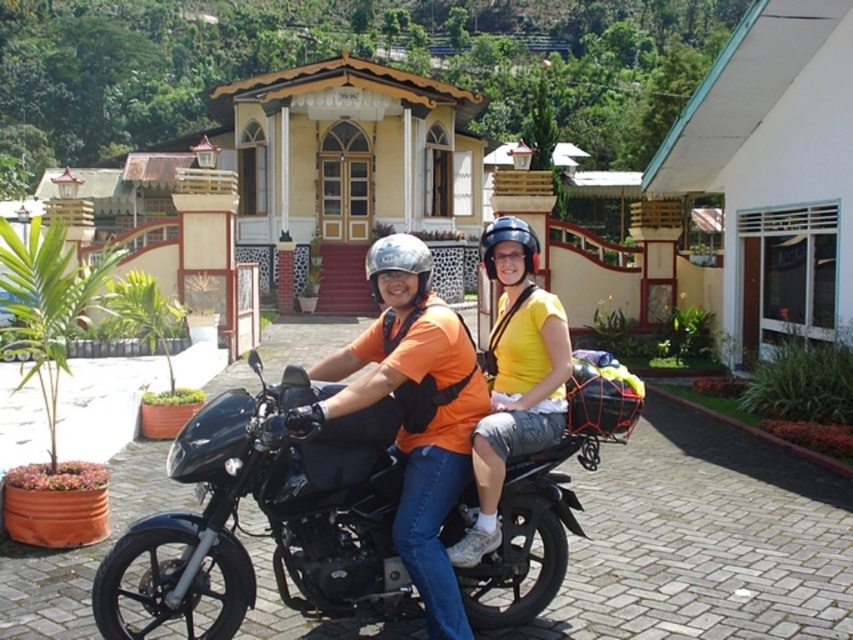
Does orange fabric shirt at center come in front of yellow matte helmet at center?

Yes.

Between orange fabric shirt at center and yellow matte helmet at center, which one is positioned lower?

orange fabric shirt at center is lower down.

What do you see at coordinates (415, 428) in the screenshot? Image resolution: width=853 pixels, height=640 pixels. I see `orange fabric shirt at center` at bounding box center [415, 428].

Where is `orange fabric shirt at center`? The image size is (853, 640). orange fabric shirt at center is located at coordinates (415, 428).

Which of these two, yellow matte helmet at center or metallic silver helmet at center, stands shorter?

yellow matte helmet at center

Which is in front, point (543, 410) or point (374, 284)?

Positioned in front is point (374, 284).

Where is `yellow matte helmet at center`? This screenshot has height=640, width=853. yellow matte helmet at center is located at coordinates coord(515,378).

Who is taller, black matte motorcycle at center or matte black helmet at center?

Standing taller between the two is matte black helmet at center.

Between point (283, 476) and point (515, 218), which one is positioned in front?

Point (283, 476)

You are a GUI agent. You are given a task and a screenshot of the screen. Output one action in this format:
    pyautogui.click(x=<x>, y=<y>)
    Task: Click on the black matte motorcycle at center
    The width and height of the screenshot is (853, 640).
    Given the screenshot: What is the action you would take?
    pyautogui.click(x=267, y=518)

In order to click on black matte motorcycle at center in this screenshot , I will do `click(267, 518)`.